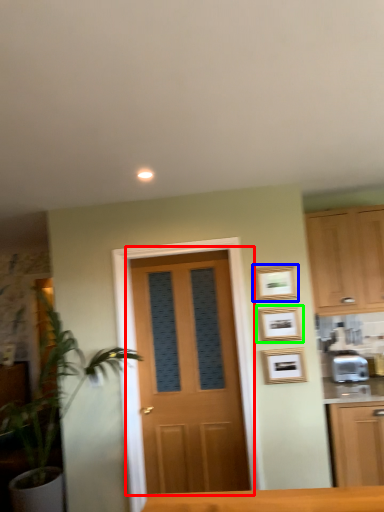
Question: Which object is the farthest from door (highlighted by a red box)? Choose among these: picture frame (highlighted by a blue box) or picture frame (highlighted by a green box).

Choices:
 (A) picture frame
 (B) picture frame

Answer: (A)